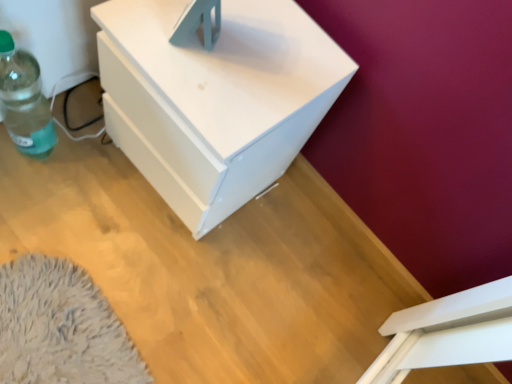
Question: From a real-world perspective, is white matte nightstand at center physically located above or below green translucent bottle at left?

Choices:
 (A) below
 (B) above

Answer: (B)

Question: Considering their positions, is white matte nightstand at center located in front of or behind green translucent bottle at left?

Choices:
 (A) behind
 (B) front

Answer: (B)

Question: Does point (237, 36) appear closer or farther from the camera than point (10, 44)?

Choices:
 (A) farther
 (B) closer

Answer: (B)

Question: Is green translucent bottle at left spatially inside white matte nightstand at center, or outside of it?

Choices:
 (A) outside
 (B) inside

Answer: (A)

Question: Is green translucent bottle at left taller or shorter than white matte nightstand at center?

Choices:
 (A) short
 (B) tall

Answer: (A)

Question: From a real-world perspective, relative to white matte nightstand at center, is green translucent bottle at left vertically above or below?

Choices:
 (A) below
 (B) above

Answer: (A)

Question: From the image's perspective, relative to white matte nightstand at center, is green translucent bottle at left above or below?

Choices:
 (A) below
 (B) above

Answer: (B)